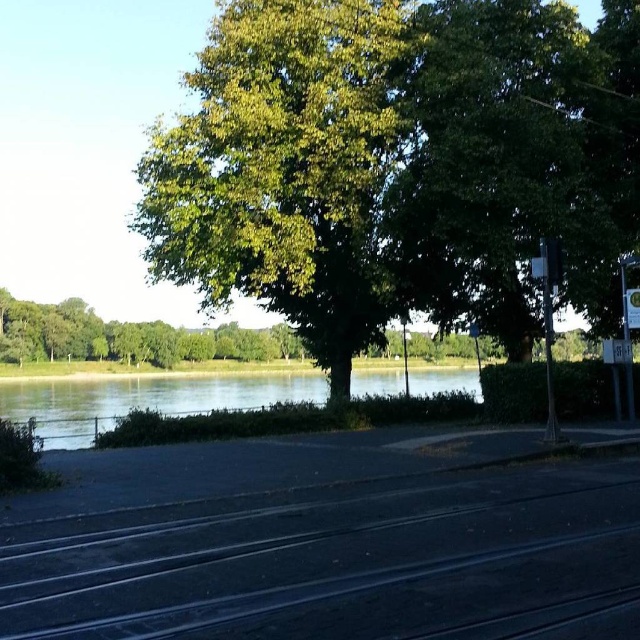
Based on the photo, you are a painter setting up your easel on the riverside path. You want to paint both the black asphalt train track at lower center and the metallic silver pole at right. Which object should you focus on first if you want to capture the wider subject?

The black asphalt train track at lower center should be focused on first since its width surpasses that of the metallic silver pole at right.

You are a painter standing on the black asphalt train track at lower center, looking towards the green leafy tree at upper center. Which object is taller?

The green leafy tree at upper center is taller than the black asphalt train track at lower center.

You are standing at the point closer to the viewer between the two points, point (616, 113) and point (12, 547). Which direction should you walk to reach the farther point?

You should walk away from the viewer towards the river to reach the farther point (12, 547) since point (616, 113) is closer to the viewer.